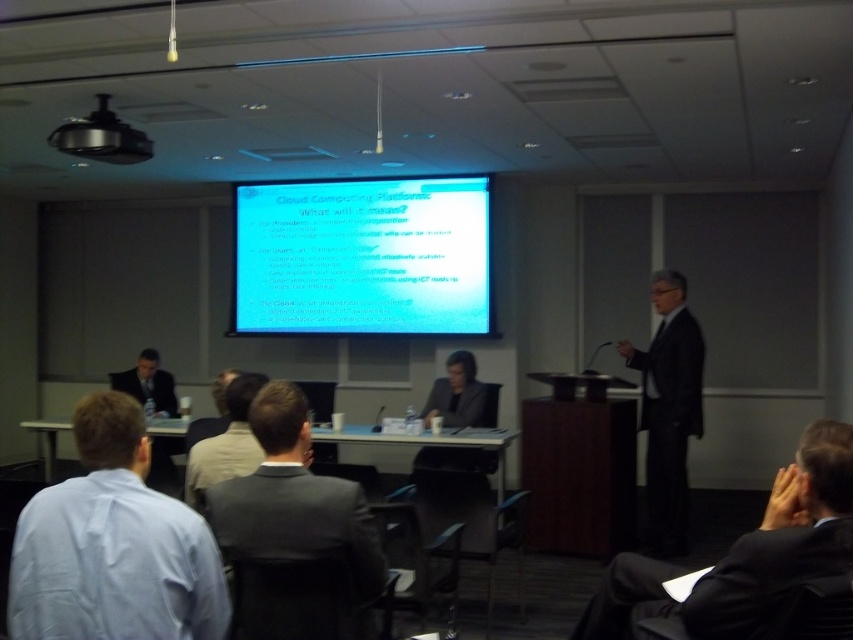
Question: Which object is positioned farthest from the light brown suit at center?

Choices:
 (A) dark suit at lower right
 (B) dark gray suit at lower left
 (C) black suit at right

Answer: (C)

Question: Is dark suit at lower right further to camera compared to black fabric business suit at center?

Choices:
 (A) yes
 (B) no

Answer: (B)

Question: Which object appears closest to the camera in this image?

Choices:
 (A) light blue shirt at lower left
 (B) dark suit at lower right

Answer: (A)

Question: Which object is the closest to the dark suit at lower right?

Choices:
 (A) white glossy projector screen at upper center
 (B) light blue shirt at lower left

Answer: (B)

Question: Can you confirm if dark gray suit at center is positioned below black plastic projector at upper center?

Choices:
 (A) yes
 (B) no

Answer: (A)

Question: Can you confirm if white glossy projector screen at upper center is positioned below light brown shirt at center?

Choices:
 (A) yes
 (B) no

Answer: (B)